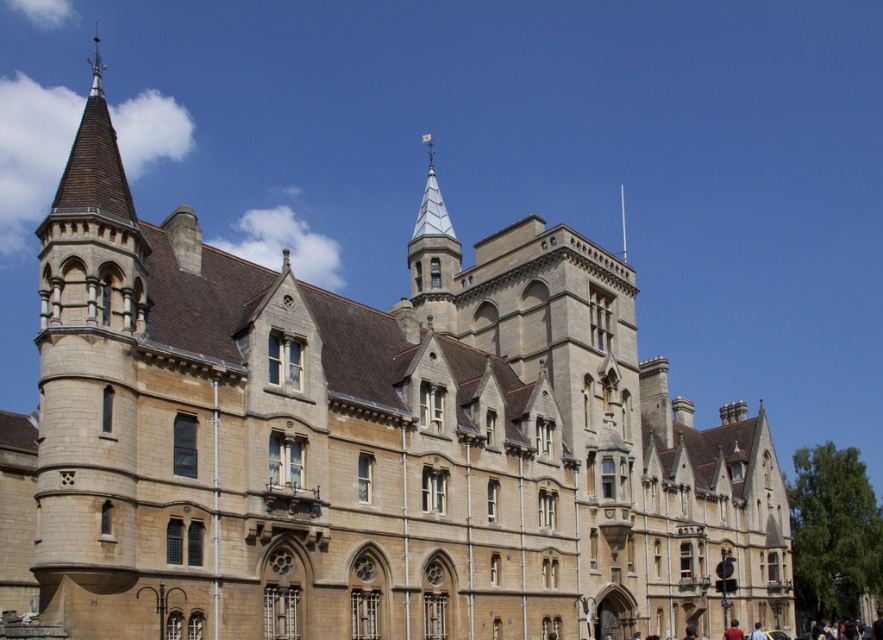
You are standing in front of the historic building and notice two elements in the scene. The first is the white glass spire at upper center and the second is the blurred yellow shirt at lower right. From your vantage point, which of these two objects is positioned higher up in the image?

The white glass spire at upper center is positioned higher up in the image than the blurred yellow shirt at lower right.

Based on the photo, you are standing in front of the grand historic building. You notice two points marked on the building. The first point is located at coordinates point [406,259] and the second at point [761,637]. From your vantage point, which of these two points is closer to you?

Point [761,637] is closer to you because it is in front of point [406,259].

You are standing in front of the grand historic building and want to take a photo of the white glass spire at upper center and the red fabric person at lower right. Which object is located to the left of the other?

The white glass spire at upper center is positioned on the left side of red fabric person at lower right.